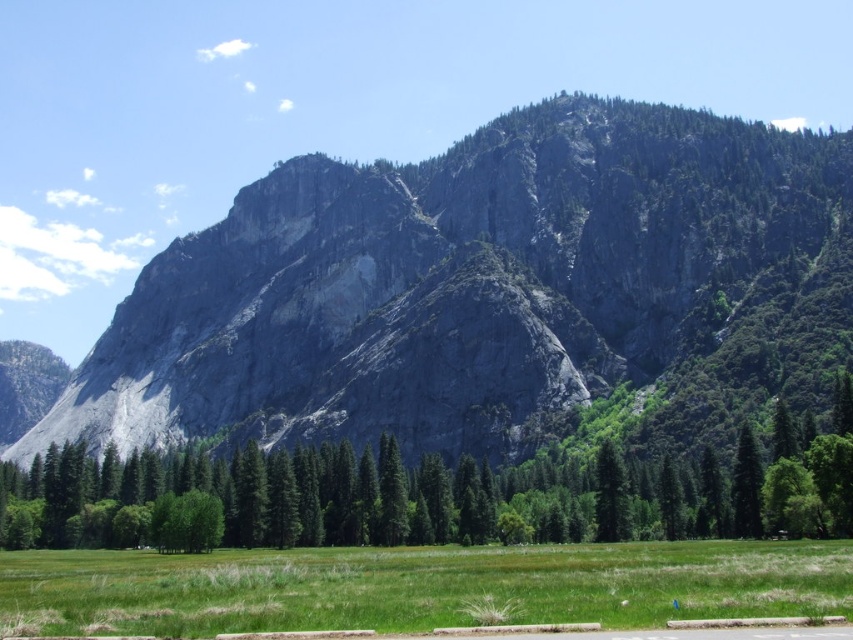
You are standing in the grassy field and want to walk towards the mountain. Which tree, the green leafy tree at center or the green matte tree at center, would you pass first?

The green leafy tree at center is closer to the viewer than the green matte tree at center, so you would pass the green leafy tree at center first when walking towards the mountain.

You are standing in the grassy field and want to walk to the green matte tree at center. Which direction should you head relative to the gray rock mountain at center?

You should head to the right side of the gray rock mountain at center because the gray rock mountain at center is positioned on the left side of the green matte tree at center.